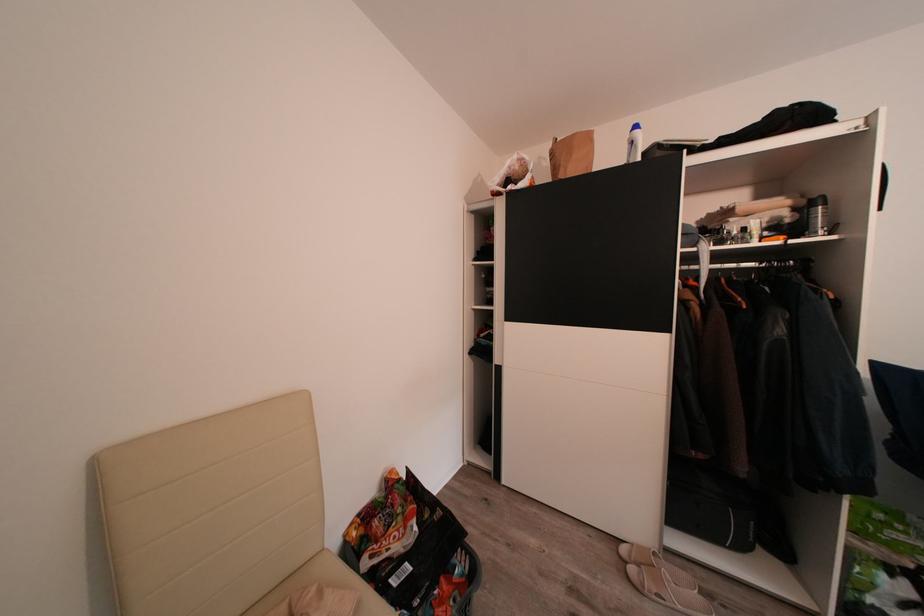
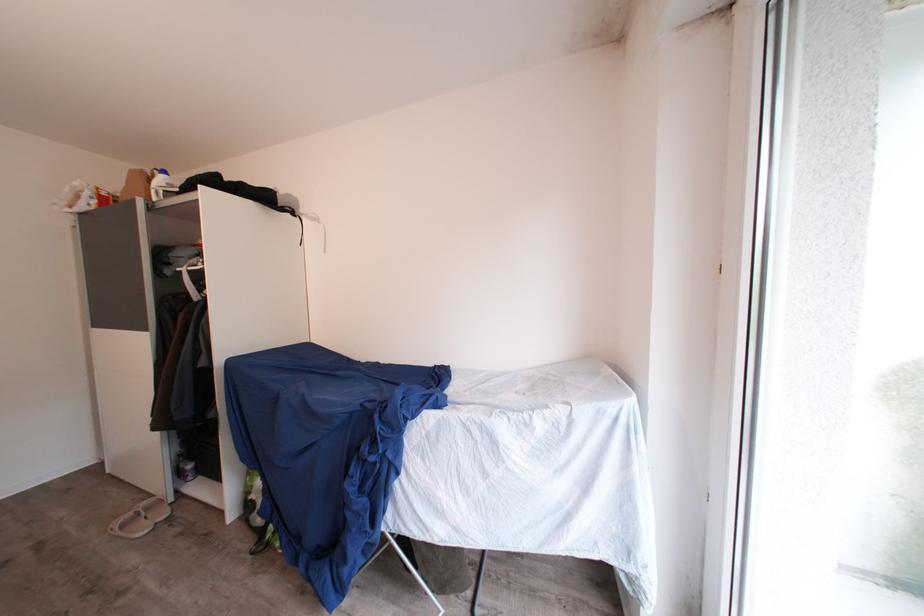
Question: Which direction would the cameraman need to move to produce the second image? Reply with the corresponding letter.

Choices:
 (A) Left
 (B) Right
 (C) Forward
 (D) Backward

Answer: (B)